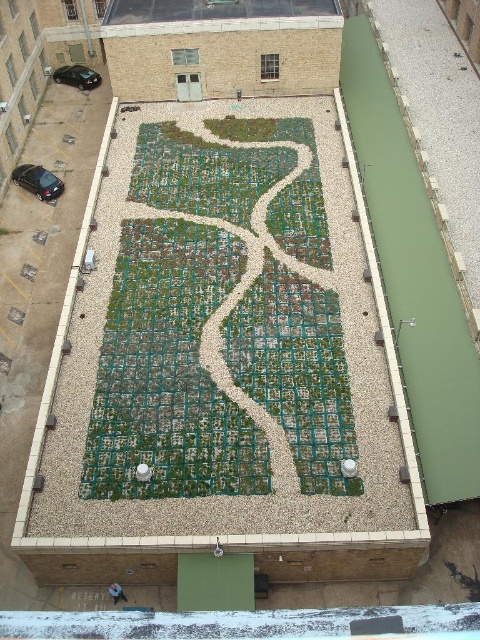
Is green textured tiles at upper center above glossy black car at lower left?

Correct, green textured tiles at upper center is located above glossy black car at lower left.

Does green textured tiles at upper center have a larger size compared to glossy black car at lower left?

Yes.

In order to click on green textured tiles at upper center in this screenshot , I will do `click(215, 10)`.

Who is shorter, green textured maze at center or green textured tiles at upper center?

With less height is green textured tiles at upper center.

Looking at this image, can you confirm if green textured maze at center is positioned above green textured tiles at upper center?

No.

The width and height of the screenshot is (480, 640). I want to click on green textured maze at center, so click(x=220, y=323).

From the picture: Between green textured tiles at upper center and shiny black car at upper left, which one appears on the right side from the viewer's perspective?

Positioned to the right is green textured tiles at upper center.

Is point (147, 3) less distant than point (88, 84)?

Yes.

Is point (283, 3) less distant than point (74, 67)?

Yes, it is in front of point (74, 67).

I want to click on green textured tiles at upper center, so click(215, 10).